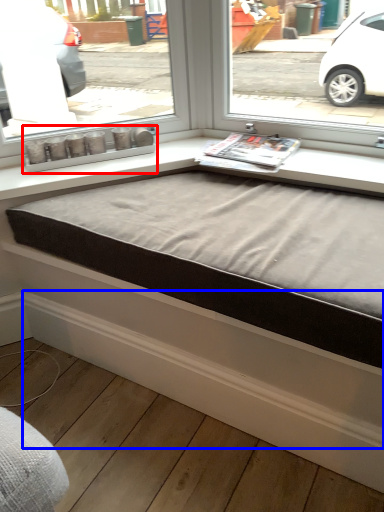
Question: Which object is closer to the camera taking this photo, window box (highlighted by a red box) or curb (highlighted by a blue box)?

Choices:
 (A) window box
 (B) curb

Answer: (B)